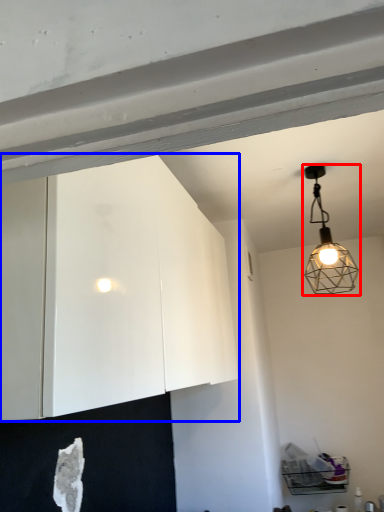
Question: Which object appears farthest to the camera in this image, lamp (highlighted by a red box) or cabinetry (highlighted by a blue box)?

Choices:
 (A) lamp
 (B) cabinetry

Answer: (A)